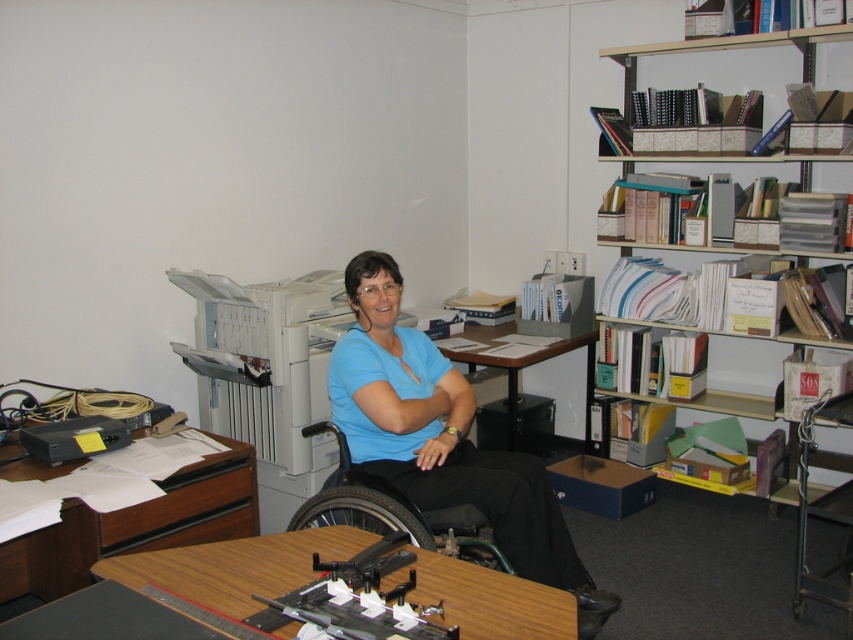
Question: Does white cardboard bookshelf at upper right appear over wooden desk at center?

Choices:
 (A) yes
 (B) no

Answer: (A)

Question: Is wooden table at center to the left of black plastic wheelchair at center from the viewer's perspective?

Choices:
 (A) yes
 (B) no

Answer: (A)

Question: Which point is closer to the camera?

Choices:
 (A) white cardboard bookshelf at upper right
 (B) wooden table at center
 (C) white plastic printer at center

Answer: (B)

Question: Which of the following is the farthest from the observer?

Choices:
 (A) wooden at left
 (B) wooden table at center
 (C) white cardboard bookshelf at upper right

Answer: (C)

Question: From the image, what is the correct spatial relationship of black plastic wheelchair at center in relation to wooden desk at center?

Choices:
 (A) above
 (B) below

Answer: (B)

Question: Which point is closer to the camera?

Choices:
 (A) wooden table at center
 (B) wooden at left
 (C) white plastic printer at center
 (D) blue cotton shirt at center

Answer: (A)